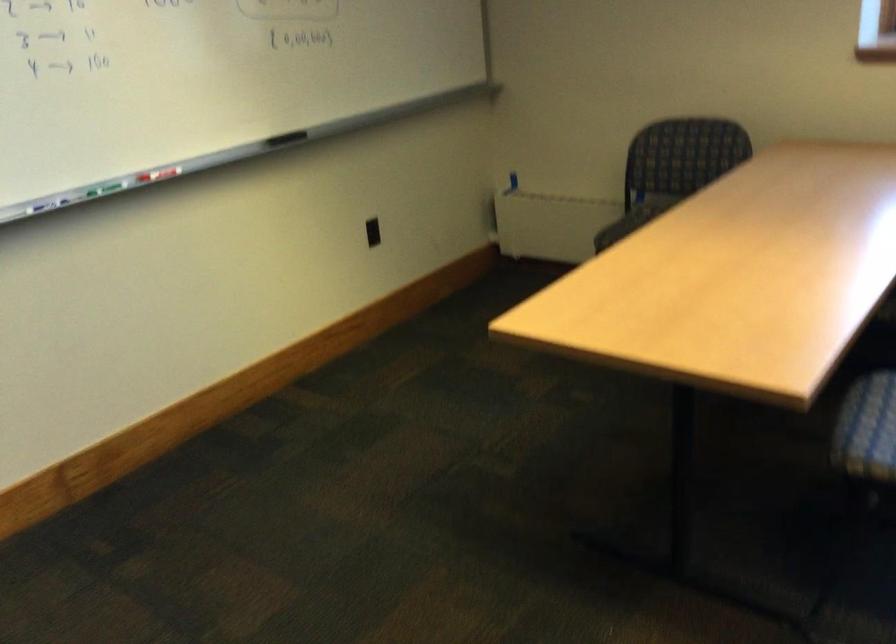
Describe the element at coordinates (513, 180) in the screenshot. I see `the blue radiator knob` at that location.